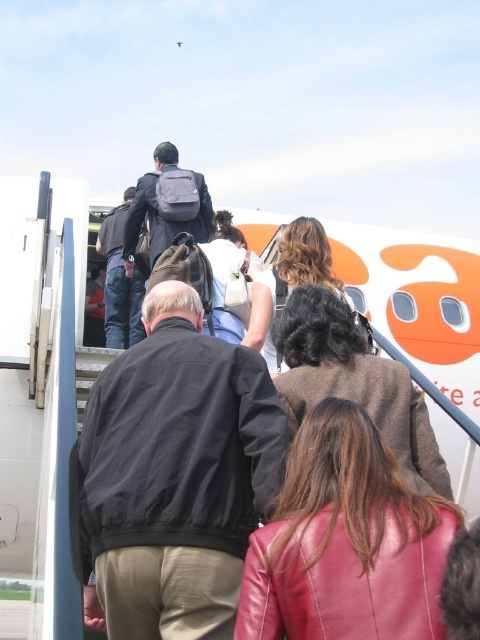
Between black leather jacket at center and brown leather jacket at center, which one appears on the right side from the viewer's perspective?

From the viewer's perspective, brown leather jacket at center appears more on the right side.

Identify the location of black leather jacket at center. This screenshot has height=640, width=480. (177, 474).

Can you confirm if white matte airplane at center is positioned below brown leather jacket at center?

Yes, white matte airplane at center is below brown leather jacket at center.

Is point (43, 369) positioned behind point (283, 346)?

No, (43, 369) is in front of (283, 346).

The height and width of the screenshot is (640, 480). I want to click on white matte airplane at center, so pyautogui.click(x=39, y=385).

Which is above, black leather jacket at center or matte gray backpack at center?

Positioned higher is matte gray backpack at center.

Where is `black leather jacket at center`? This screenshot has width=480, height=640. black leather jacket at center is located at coordinates (177, 474).

This screenshot has height=640, width=480. Find the location of `black leather jacket at center`. black leather jacket at center is located at coordinates (177, 474).

Locate an element on the screen. The image size is (480, 640). black leather jacket at center is located at coordinates (177, 474).